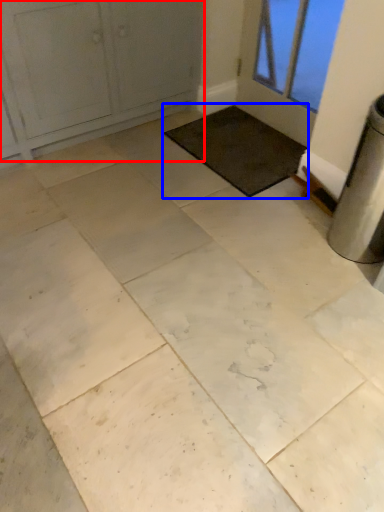
Question: Which object is closer to the camera taking this photo, door (highlighted by a red box) or mat (highlighted by a blue box)?

Choices:
 (A) door
 (B) mat

Answer: (A)